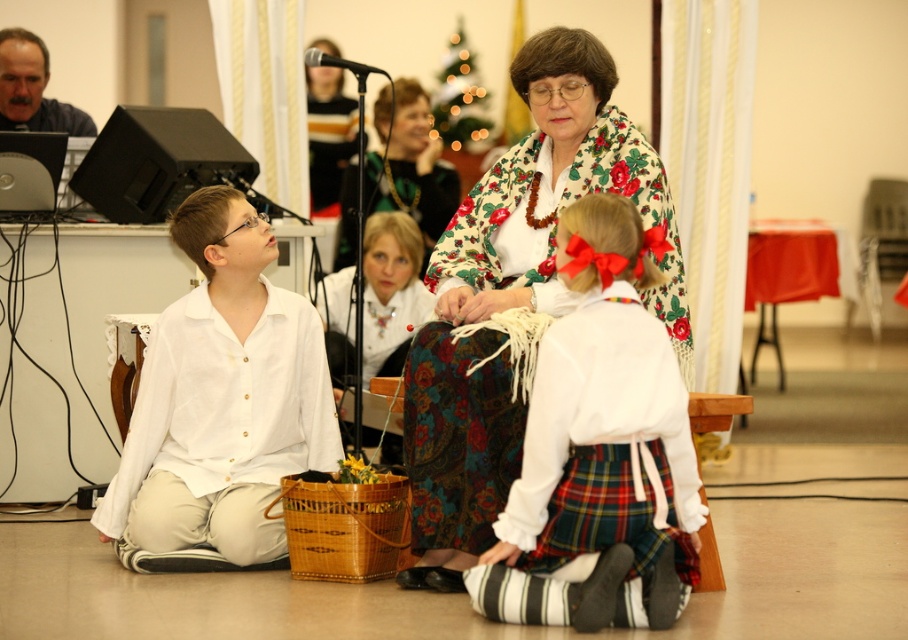
Who is taller, white cotton blouse at center or white linen shirt at left?

With more height is white linen shirt at left.

Is point (569, 236) farther from viewer compared to point (216, 310)?

No, it is in front of (216, 310).

At what (x,y) coordinates should I click in order to perform the action: click on white cotton blouse at center. Please return your answer as a coordinate pair (x, y). The height and width of the screenshot is (640, 908). Looking at the image, I should click on (600, 449).